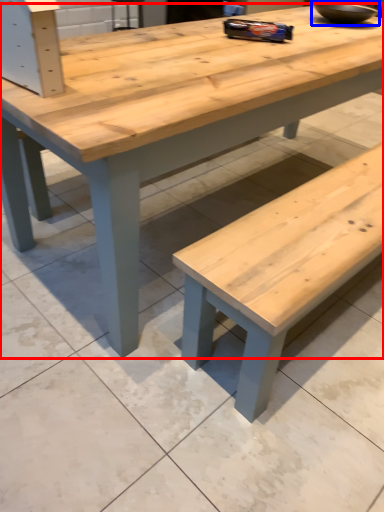
Question: Among these objects, which one is nearest to the camera, table (highlighted by a red box) or bowl (highlighted by a blue box)?

Choices:
 (A) table
 (B) bowl

Answer: (A)